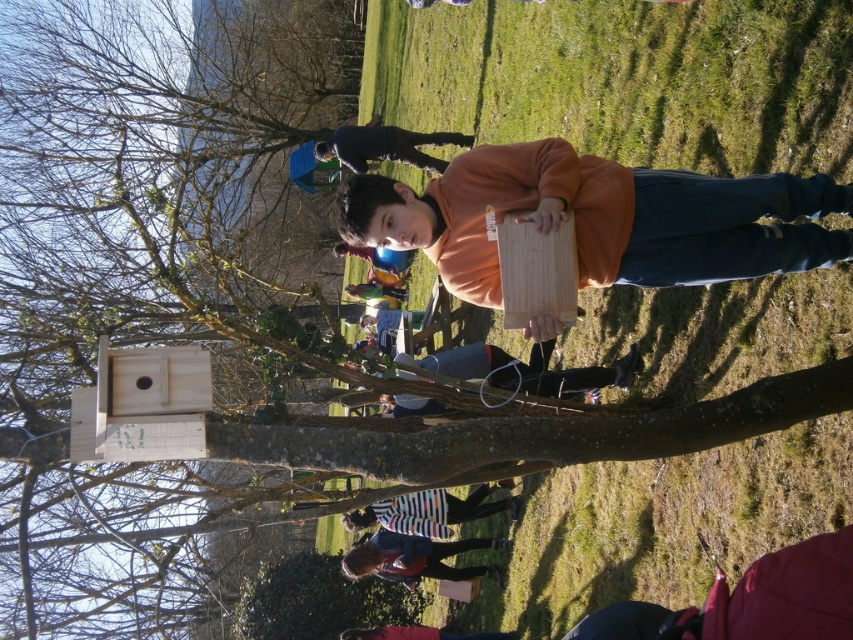
Is striped fabric shirt at center below striped fabric at center?

No, striped fabric shirt at center is not below striped fabric at center.

Is point (541, 364) positioned in front of point (347, 518)?

Yes, it is.

The height and width of the screenshot is (640, 853). In order to click on striped fabric shirt at center in this screenshot , I will do `click(531, 371)`.

Is matte wood board at center to the right of striped fabric shirt at center from the viewer's perspective?

Indeed, matte wood board at center is positioned on the right side of striped fabric shirt at center.

Is point (634, 179) less distant than point (387, 404)?

Yes, point (634, 179) is closer to viewer.

You are a GUI agent. You are given a task and a screenshot of the screen. Output one action in this format:
    pyautogui.click(x=<x>, y=<y>)
    Task: Click on the matte wood board at center
    This screenshot has width=853, height=640.
    Given the screenshot: What is the action you would take?
    click(x=599, y=218)

Can you confirm if matte wood board at center is thinner than orange cotton hoodie at center?

Indeed, matte wood board at center has a lesser width compared to orange cotton hoodie at center.

Does matte wood board at center appear on the right side of orange cotton hoodie at center?

Yes, matte wood board at center is to the right of orange cotton hoodie at center.

Does point (809, 209) come behind point (405, 140)?

No, it is not.

The height and width of the screenshot is (640, 853). I want to click on matte wood board at center, so click(599, 218).